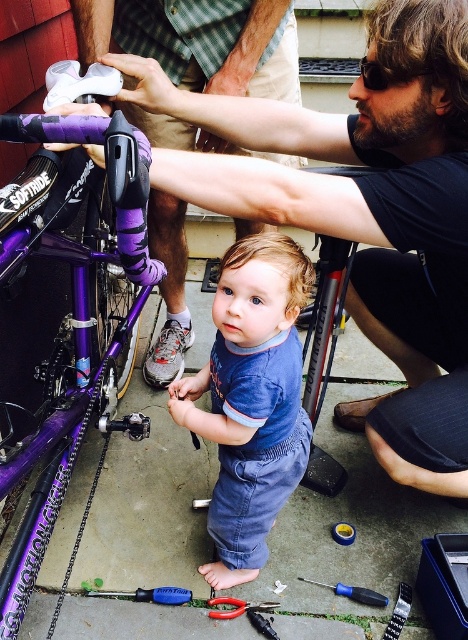
Does purple matte bicycle at left appear on the left side of blue denim overalls at center?

Yes, purple matte bicycle at left is to the left of blue denim overalls at center.

Between point (7, 486) and point (228, 385), which one is positioned in front?

Point (7, 486)

This screenshot has width=468, height=640. What do you see at coordinates (74, 328) in the screenshot? I see `purple matte bicycle at left` at bounding box center [74, 328].

Locate an element on the screen. This screenshot has height=640, width=468. purple matte bicycle at left is located at coordinates (74, 328).

Who is taller, purple matte bicycle at left or blue plastic screwdriver at center?

With more height is purple matte bicycle at left.

Which is more to the right, purple matte bicycle at left or blue plastic screwdriver at center?

From the viewer's perspective, blue plastic screwdriver at center appears more on the right side.

Does point (64, 333) come in front of point (343, 593)?

No, (64, 333) is behind (343, 593).

Locate an element on the screen. The width and height of the screenshot is (468, 640). purple matte bicycle at left is located at coordinates (74, 328).

Can you confirm if metallic silver pliers at lower center is positioned to the right of blue plastic screwdriver at center?

No, metallic silver pliers at lower center is not to the right of blue plastic screwdriver at center.

Can you confirm if metallic silver pliers at lower center is shorter than blue plastic screwdriver at center?

Yes.

Image resolution: width=468 pixels, height=640 pixels. Describe the element at coordinates (236, 605) in the screenshot. I see `metallic silver pliers at lower center` at that location.

The image size is (468, 640). I want to click on metallic silver pliers at lower center, so click(x=236, y=605).